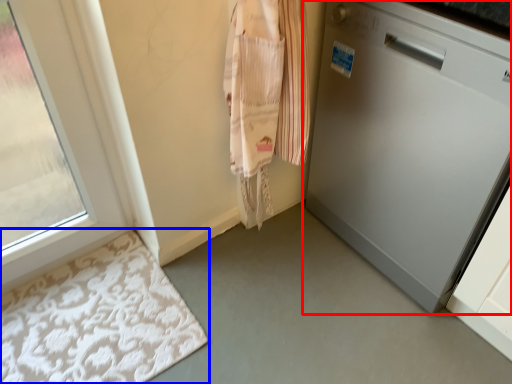
Question: Among these objects, which one is farthest to the camera, home appliance (highlighted by a red box) or bath mat (highlighted by a blue box)?

Choices:
 (A) home appliance
 (B) bath mat

Answer: (B)